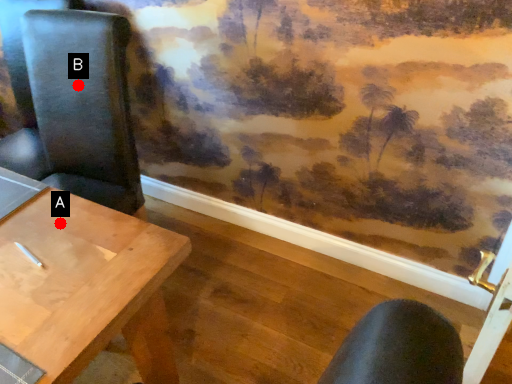
Question: Two points are circled on the image, labeled by A and B beside each circle. Which point is closer to the camera taking this photo?

Choices:
 (A) A is closer
 (B) B is closer

Answer: (A)